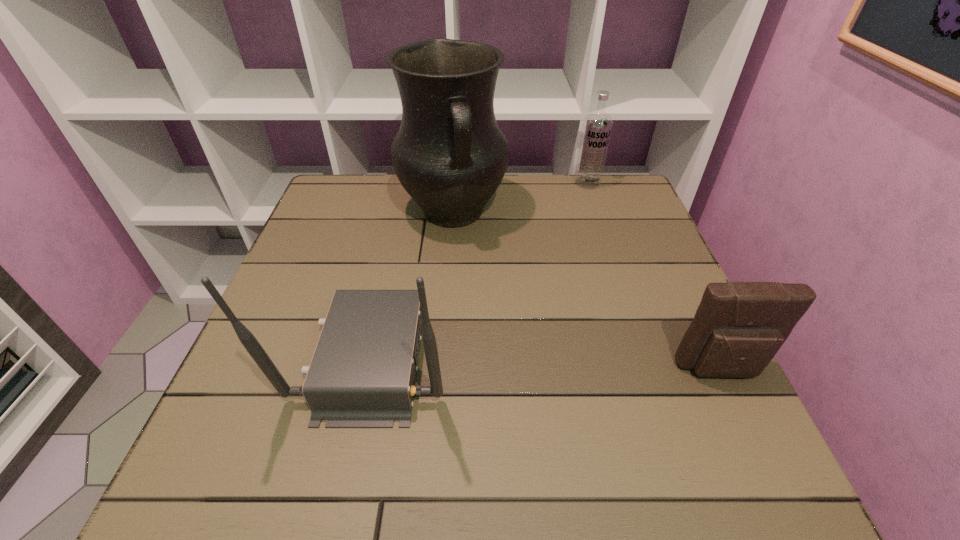
Locate an element on the screen. the second tallest object is located at coordinates (363, 372).

Locate an element on the screen. This screenshot has width=960, height=540. the rightmost object is located at coordinates (738, 328).

What are the coordinates of `pouch` in the screenshot? It's located at (738, 328).

Identify the location of the tallest object. The image size is (960, 540). (449, 154).

Locate an element on the screen. The height and width of the screenshot is (540, 960). the third tallest object is located at coordinates (597, 126).

The height and width of the screenshot is (540, 960). In order to click on vodka in this screenshot , I will do `click(597, 126)`.

At what (x,y) coordinates should I click in order to perform the action: click on vacant region located on the back of the second tallest object to connect cables. Please return your answer as a coordinate pair (x, y). Looking at the image, I should click on (249, 357).

Locate an element on the screen. This screenshot has width=960, height=540. free space located 0.290m on the handle side of the pitcher is located at coordinates (496, 338).

Where is `vacant area located on the handle side of the pitcher`? This screenshot has height=540, width=960. vacant area located on the handle side of the pitcher is located at coordinates (469, 261).

This screenshot has width=960, height=540. I want to click on vacant space situated 0.140m on the handle side of the pitcher, so click(x=478, y=286).